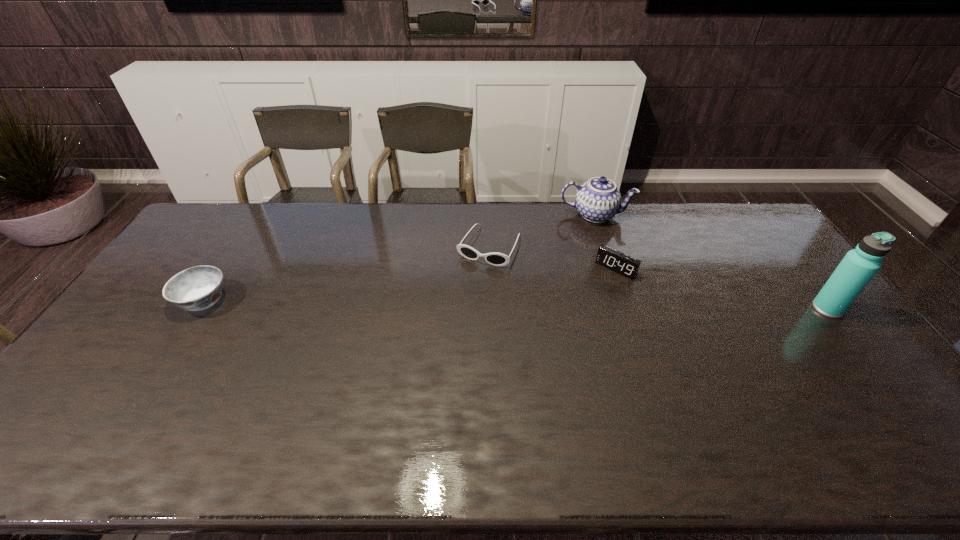
Image resolution: width=960 pixels, height=540 pixels. What are the coordinates of `ashtray` in the screenshot? It's located at (196, 288).

The image size is (960, 540). Identify the location of the rightmost object. (858, 267).

The image size is (960, 540). Identify the location of thermos bottle. (858, 267).

Find the location of a particular element. The image size is (960, 540). alarm clock is located at coordinates (623, 264).

Identify the location of sunglasses. pos(496,259).

Where is `the fourth object from right to left`? This screenshot has width=960, height=540. the fourth object from right to left is located at coordinates (496, 259).

At what (x,y) coordinates should I click in order to perform the action: click on chinaware. Please return your answer as a coordinate pair (x, y). The width and height of the screenshot is (960, 540). Looking at the image, I should click on (597, 200).

You are a GUI agent. You are given a task and a screenshot of the screen. Output one action in this format:
    pyautogui.click(x=<x>, y=<y>)
    Task: Click on the free space located 0.300m on the front of the leftmost object
    The height and width of the screenshot is (540, 960).
    Given the screenshot: What is the action you would take?
    pyautogui.click(x=132, y=413)

You are a GUI agent. You are given a task and a screenshot of the screen. Output one action in this format:
    pyautogui.click(x=<x>, y=<y>)
    Task: Click on the vacant region located on the back of the thermos bottle
    The width and height of the screenshot is (960, 540).
    Given the screenshot: What is the action you would take?
    pyautogui.click(x=777, y=244)

Where is `blank space located 0.380m on the front-facing side of the alarm clock`? The width and height of the screenshot is (960, 540). blank space located 0.380m on the front-facing side of the alarm clock is located at coordinates (540, 350).